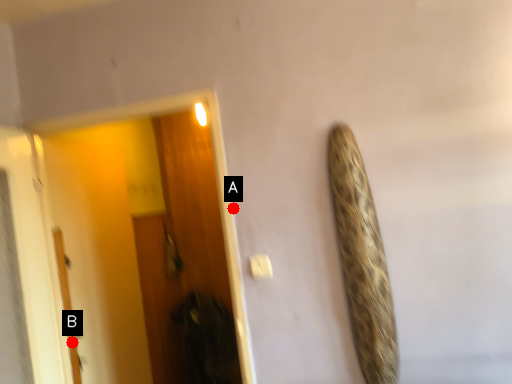
Question: Two points are circled on the image, labeled by A and B beside each circle. Which point is further to the camera?

Choices:
 (A) A is further
 (B) B is further

Answer: (B)